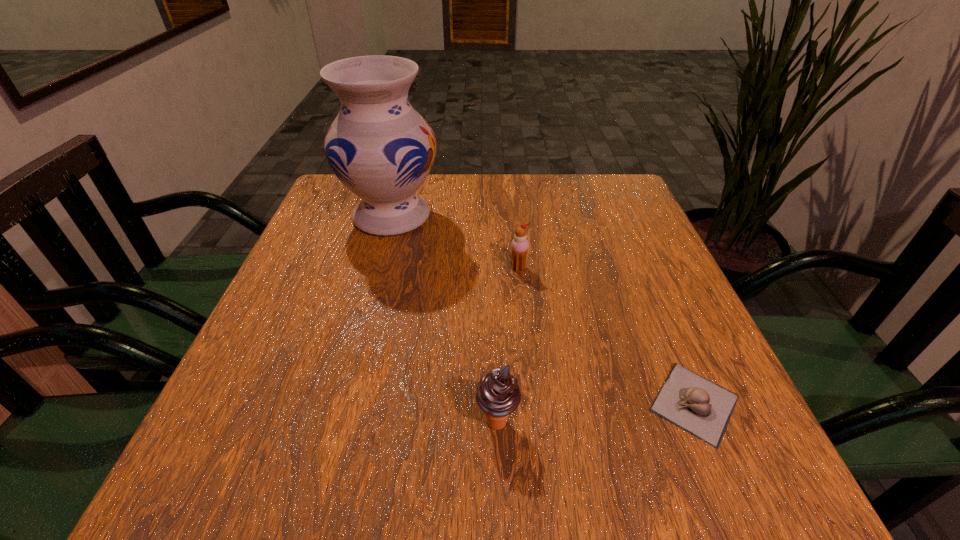
The height and width of the screenshot is (540, 960). I want to click on the farthest object, so click(x=380, y=148).

Identify the location of vase. (380, 148).

This screenshot has height=540, width=960. In order to click on the left icecream in this screenshot , I will do `click(498, 395)`.

Find the location of a particular element. the third object from right to left is located at coordinates (498, 395).

Where is `the right icecream`? The image size is (960, 540). the right icecream is located at coordinates (519, 246).

At what (x,y) coordinates should I click in order to perform the action: click on the shorter icecream. Please return your answer as a coordinate pair (x, y). The width and height of the screenshot is (960, 540). Looking at the image, I should click on (519, 246).

Locate an element on the screen. This screenshot has width=960, height=540. the rightmost object is located at coordinates (695, 404).

At what (x,y) coordinates should I click in order to perform the action: click on the shortest object. Please return your answer as a coordinate pair (x, y). This screenshot has height=540, width=960. Looking at the image, I should click on coord(695,404).

Where is `blank space located on the front of the tallest object`? Image resolution: width=960 pixels, height=540 pixels. blank space located on the front of the tallest object is located at coordinates (x=347, y=383).

Locate an element on the screen. vacant region located 0.330m on the right of the left icecream is located at coordinates (733, 422).